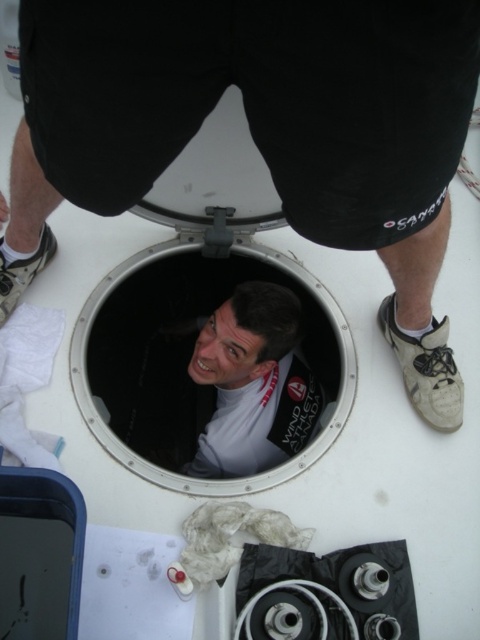
Which is behind, point (469, 104) or point (123, 260)?

Positioned behind is point (123, 260).

What do you see at coordinates (261, 131) in the screenshot?
I see `white matte face at center` at bounding box center [261, 131].

The image size is (480, 640). Identify the location of white matte face at center. (261, 131).

Who is shorter, white matte face at center or white matte shirt at center?

Standing shorter between the two is white matte shirt at center.

Can you confirm if white matte face at center is positioned below white matte shirt at center?

Actually, white matte face at center is above white matte shirt at center.

Locate an element on the screen. white matte face at center is located at coordinates (261, 131).

Is white metallic porthole at center to the left of white matte shirt at center from the viewer's perspective?

Correct, you'll find white metallic porthole at center to the left of white matte shirt at center.

Can you confirm if white metallic porthole at center is bigger than white matte shirt at center?

Yes.

Image resolution: width=480 pixels, height=640 pixels. I want to click on white metallic porthole at center, so click(x=189, y=358).

Find the location of a particular element. The height and width of the screenshot is (640, 480). white metallic porthole at center is located at coordinates (189, 358).